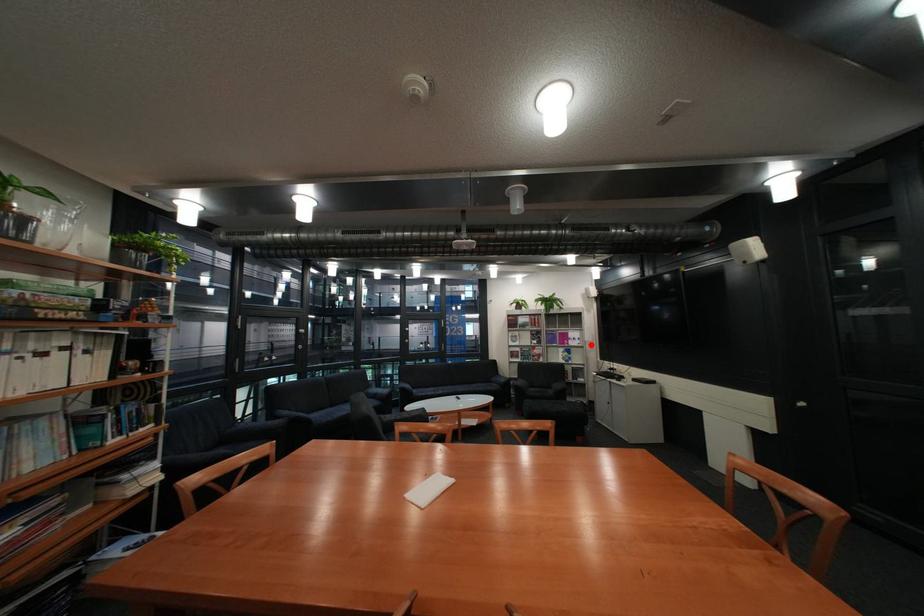
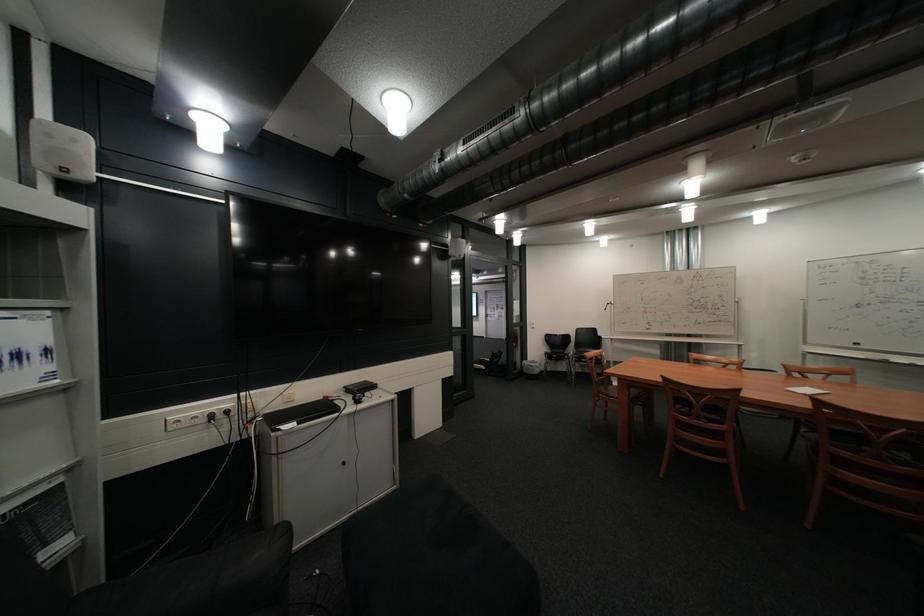
Where in the second image is the point corresponding to the highlighted location from the first image?

(46, 386)